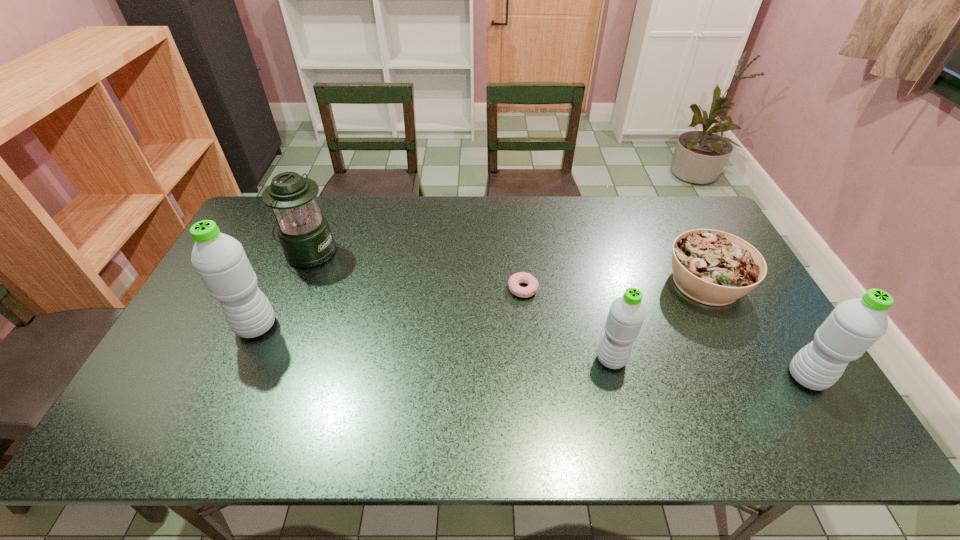
At what (x,y) coordinates should I click in order to perform the action: click on free point between the third object from right to left and the lantern. Please return your answer as a coordinate pair (x, y). Image resolution: width=960 pixels, height=540 pixels. Looking at the image, I should click on (460, 306).

Where is `free area in between the second shortest water bottle and the leftmost water bottle`? free area in between the second shortest water bottle and the leftmost water bottle is located at coordinates click(532, 352).

Find the location of a particular element. Image resolution: width=960 pixels, height=540 pixels. vacant space in between the farthest water bottle and the shortest object is located at coordinates (390, 308).

Where is `vacant area that lies between the shortest water bottle and the third object from left to right`? vacant area that lies between the shortest water bottle and the third object from left to right is located at coordinates (567, 325).

Image resolution: width=960 pixels, height=540 pixels. Identify the location of vacant area that lies between the lantern and the rightmost water bottle. (558, 314).

Identify which object is the fourth closest to the rightmost water bottle. Please provide its 2D coordinates. Your answer should be formatted as a tuple, i.e. [(x, y)], where the tuple contains the x and y coordinates of a point satisfying the conditions above.

[(304, 233)]

Locate which object is the fifth closest to the rightmost water bottle. Please provide its 2D coordinates. Your answer should be formatted as a tuple, i.e. [(x, y)], where the tuple contains the x and y coordinates of a point satisfying the conditions above.

[(220, 260)]

Image resolution: width=960 pixels, height=540 pixels. What are the coordinates of `the third closest water bottle to the salad` in the screenshot? It's located at (220, 260).

I want to click on water bottle that stands as the second closest to the second water bottle from right to left, so click(220, 260).

Locate an element on the screen. vacant area that satisfies the following two spatial constraints: 1. on the back side of the salad; 2. on the right side of the doughnut is located at coordinates (x=522, y=282).